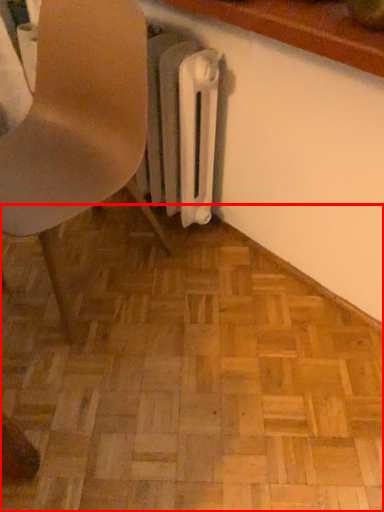
Question: From the image's perspective, where is plywood (annotated by the red box) located in relation to chair in the image?

Choices:
 (A) above
 (B) below

Answer: (B)